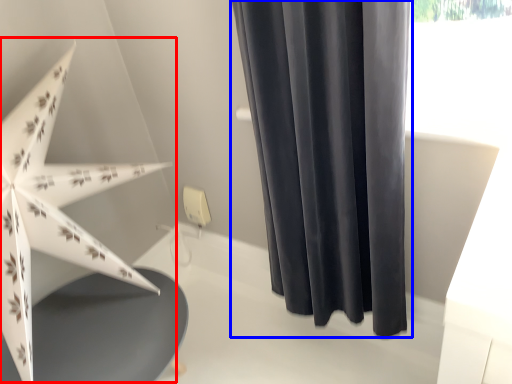
Question: Which of the following is the closest to the observer, umbrella (highlighted by a red box) or curtain (highlighted by a blue box)?

Choices:
 (A) umbrella
 (B) curtain

Answer: (A)